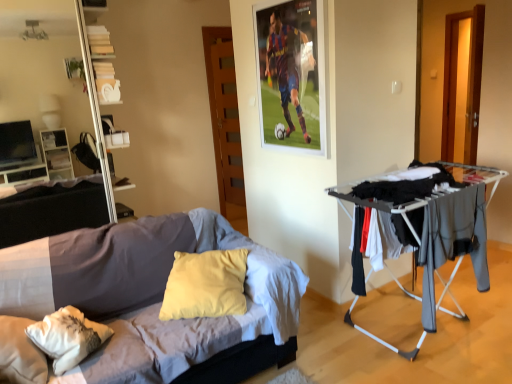
You are a GUI agent. You are given a task and a screenshot of the screen. Output one action in this format:
    pyautogui.click(x=<x>, y=<y>)
    Task: Click on the soft cotton bed at center
    The width and height of the screenshot is (512, 384).
    Given the screenshot: What is the action you would take?
    pyautogui.click(x=147, y=293)

I want to click on white glossy entertainment center at left, so click(x=56, y=113).

You are a GUI agent. You are given a task and a screenshot of the screen. Output one action in this format:
    pyautogui.click(x=<x>, y=<y>)
    Task: Click on the soft cotton bed at center
    The image size is (512, 384).
    Given the screenshot: What is the action you would take?
    pyautogui.click(x=147, y=293)

From the picture: Considering the relative positions of soft cotton bed at center and white glossy entertainment center at left in the image provided, is soft cotton bed at center to the right of white glossy entertainment center at left from the viewer's perspective?

Correct, you'll find soft cotton bed at center to the right of white glossy entertainment center at left.

Where is `bed below the white glossy entertainment center at left (from the image's perspective)`? bed below the white glossy entertainment center at left (from the image's perspective) is located at coordinates (147, 293).

Based on the photo, would you say white glossy bookshelf at upper left is inside or outside soft cotton bed at center?

The correct answer is: outside.

Is white glossy bookshelf at upper left positioned with its back to soft cotton bed at center?

No, white glossy bookshelf at upper left is not facing the opposite direction of soft cotton bed at center.

This screenshot has width=512, height=384. What are the coordinates of `bed below the white glossy bookshelf at upper left (from the image's perspective)` in the screenshot? It's located at (147, 293).

From the image's perspective, is soft cotton bed at center below white glossy bookshelf at upper left?

Yes.

Is point (259, 287) positioned before point (87, 39)?

Yes, point (259, 287) is closer to viewer.

Consider the image. Is soft cotton bed at center placed right next to white glossy bookshelf at upper left?

No, soft cotton bed at center is not with white glossy bookshelf at upper left.

Considering the relative positions of soft cotton bed at center and white glossy bookshelf at upper left in the image provided, is soft cotton bed at center to the left of white glossy bookshelf at upper left from the viewer's perspective?

Incorrect, soft cotton bed at center is not on the left side of white glossy bookshelf at upper left.

Does white glossy bookshelf at upper left have a lesser height compared to white glossy entertainment center at left?

No.

The height and width of the screenshot is (384, 512). What are the coordinates of `shelf that appears behind the white glossy entertainment center at left` in the screenshot? It's located at (95, 111).

Which is farther, (89, 85) or (29, 202)?

The point (29, 202) is more distant.

From the image's perspective, is white glossy bookshelf at upper left positioned above or below white glossy entertainment center at left?

white glossy bookshelf at upper left is above white glossy entertainment center at left.

Between white glossy entertainment center at left and soft cotton bed at center, which one has smaller size?

With smaller size is white glossy entertainment center at left.

From the picture: Are white glossy entertainment center at left and soft cotton bed at center far apart?

white glossy entertainment center at left is far away from soft cotton bed at center.

How many degrees apart are the facing directions of white glossy entertainment center at left and soft cotton bed at center?

white glossy entertainment center at left and soft cotton bed at center are facing 1.13 degrees away from each other.

From the picture: Is white glossy entertainment center at left turned away from white glossy bookshelf at upper left?

No, white glossy entertainment center at left is not facing away from white glossy bookshelf at upper left.

Is white glossy bookshelf at upper left inside white glossy entertainment center at left?

No, white glossy entertainment center at left does not contain white glossy bookshelf at upper left.

Consider the image. From the image's perspective, which object appears higher, white glossy entertainment center at left or white glossy bookshelf at upper left?

white glossy bookshelf at upper left, from the image's perspective.

This screenshot has width=512, height=384. Find the location of `entertainment center that is above the soft cotton bed at center (from a real-world perspective)`. entertainment center that is above the soft cotton bed at center (from a real-world perspective) is located at coordinates (56, 113).

The height and width of the screenshot is (384, 512). Identify the location of shelf on the left of soft cotton bed at center. (95, 111).

Based on the photo, when comparing their distances from white glossy bookshelf at upper left, does white glossy entertainment center at left or soft cotton bed at center seem closer?

soft cotton bed at center is positioned closer to the anchor white glossy bookshelf at upper left.

Looking at the image, which one is located further to white glossy bookshelf at upper left, soft cotton bed at center or white glossy entertainment center at left?

white glossy entertainment center at left is positioned further to the anchor white glossy bookshelf at upper left.

From the image, which object appears to be nearer to white glossy entertainment center at left, white glossy bookshelf at upper left or soft cotton bed at center?

white glossy bookshelf at upper left is positioned closer to the anchor white glossy entertainment center at left.

Looking at the image, which one is located closer to white glossy entertainment center at left, soft cotton bed at center or white glossy bookshelf at upper left?

Based on the image, white glossy bookshelf at upper left appears to be nearer to white glossy entertainment center at left.

From the image, which object appears to be nearer to soft cotton bed at center, white glossy entertainment center at left or white glossy bookshelf at upper left?

white glossy bookshelf at upper left lies closer to soft cotton bed at center than the other object.

Considering their positions, is white glossy bookshelf at upper left positioned further to soft cotton bed at center than white glossy entertainment center at left?

white glossy entertainment center at left lies further to soft cotton bed at center than the other object.

You are a GUI agent. You are given a task and a screenshot of the screen. Output one action in this format:
    pyautogui.click(x=<x>, y=<y>)
    Task: Click on the entertainment center between soft cotton bed at center and white glossy bookshelf at upper left in the front-back direction
    
    Given the screenshot: What is the action you would take?
    pyautogui.click(x=56, y=113)